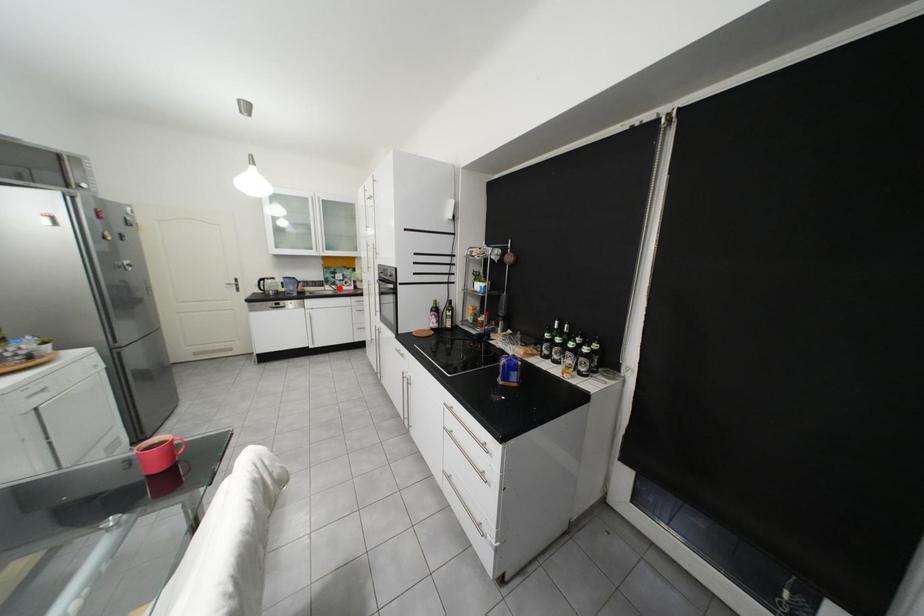
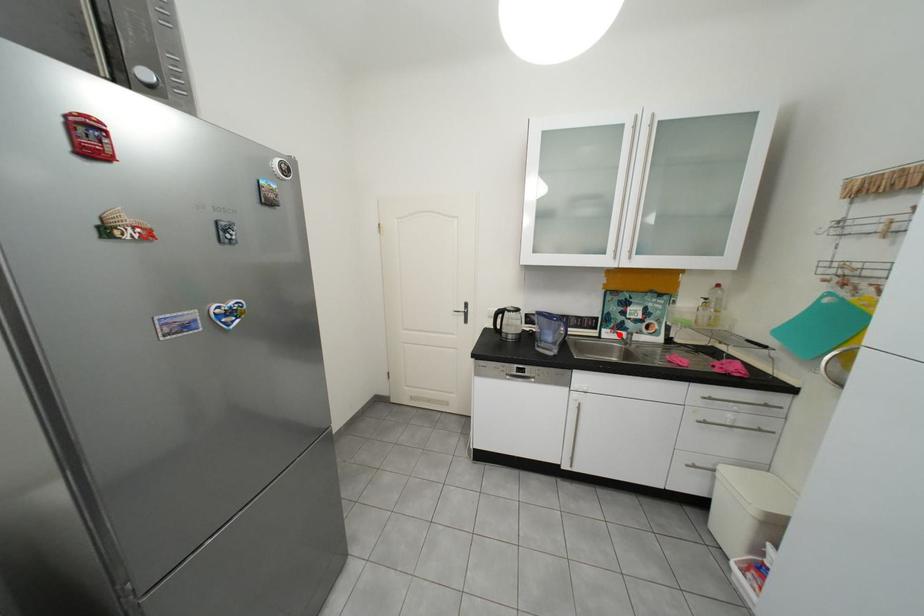
I am providing you with two images of the same scene from different viewpoints. A red point is marked on the first image and another point is marked on the second image. Are the points marked in image1 and image2 representing the same 3D position?

Yes